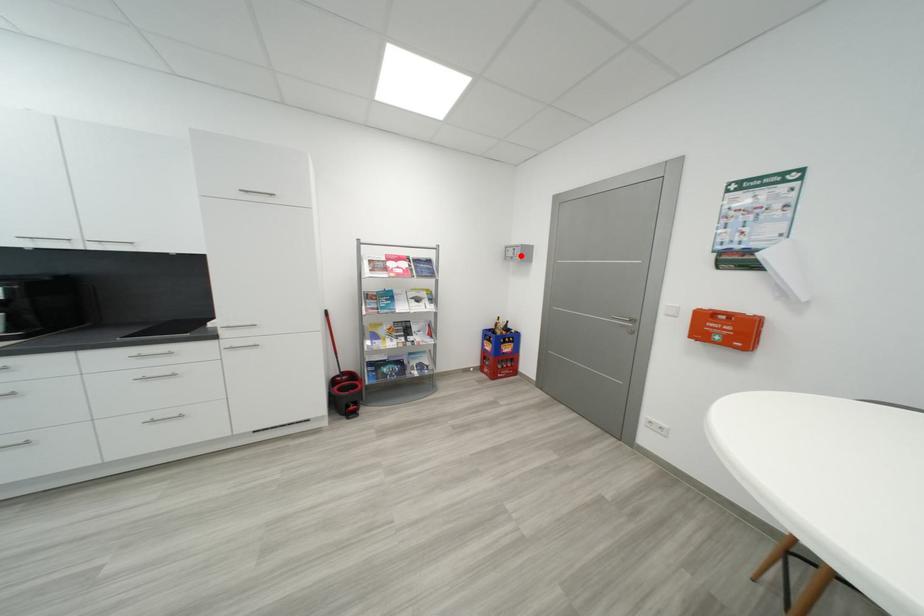
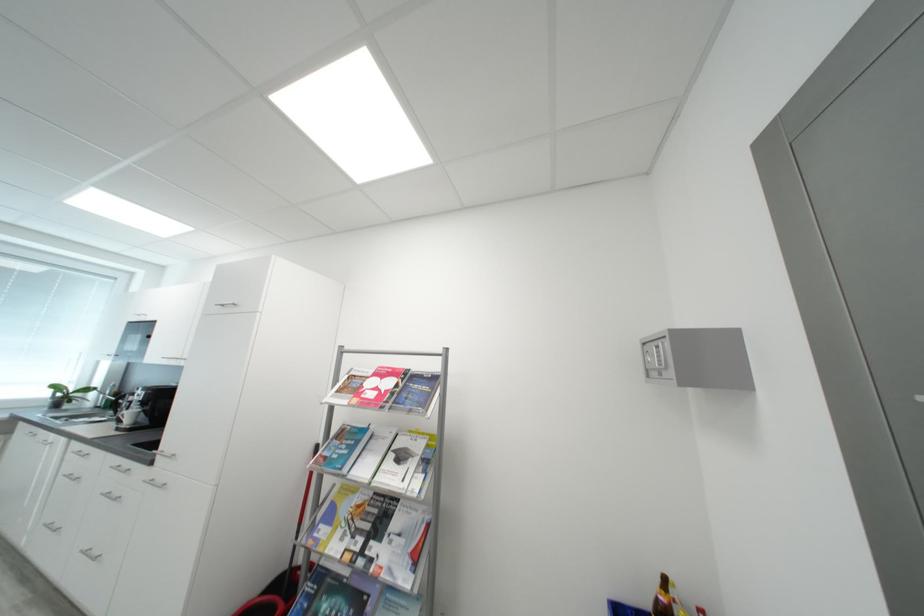
Find the pixel in the second image that matches the highlighted location in the first image.

(666, 362)